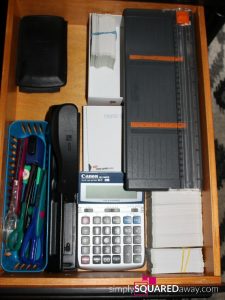
Find the location of `pens`. pens is located at coordinates (23, 203), (34, 184).